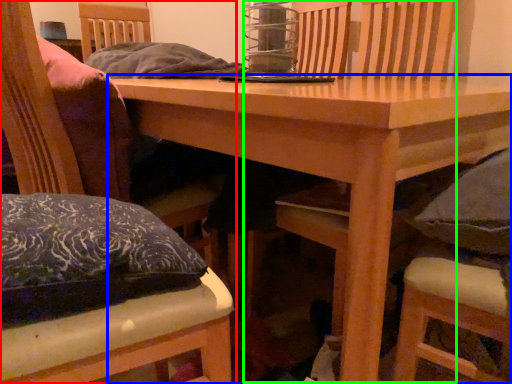
Question: Which object is the farthest from chair (highlighted by a red box)? Choose among these: table (highlighted by a blue box) or armchair (highlighted by a green box).

Choices:
 (A) table
 (B) armchair

Answer: (B)